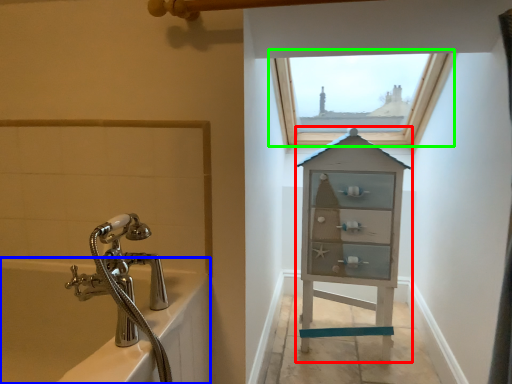
Question: Estimate the real-world distances between objects in this image. Which object is closer to medicine cabinet (highlighted by a red box), bath (highlighted by a blue box) or window (highlighted by a green box)?

Choices:
 (A) bath
 (B) window

Answer: (B)